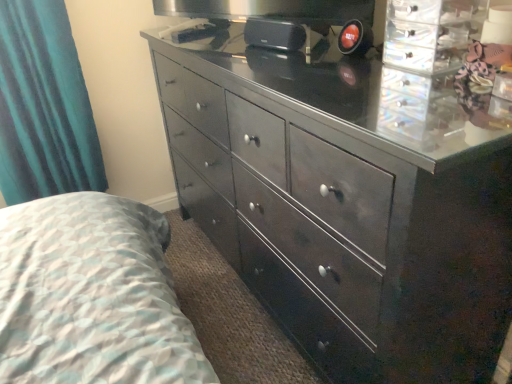
Question: In terms of width, does glossy dark wood dresser at center look wider or thinner when compared to teal velvet curtain at left?

Choices:
 (A) thin
 (B) wide

Answer: (B)

Question: Is glossy dark wood dresser at center in front of or behind teal velvet curtain at left in the image?

Choices:
 (A) behind
 (B) front

Answer: (B)

Question: Considering the positions of glossy dark wood dresser at center and teal velvet curtain at left in the image, is glossy dark wood dresser at center bigger or smaller than teal velvet curtain at left?

Choices:
 (A) big
 (B) small

Answer: (A)

Question: In terms of size, does teal velvet curtain at left appear bigger or smaller than glossy dark wood dresser at center?

Choices:
 (A) small
 (B) big

Answer: (A)

Question: In terms of width, does teal velvet curtain at left look wider or thinner when compared to glossy dark wood dresser at center?

Choices:
 (A) wide
 (B) thin

Answer: (B)

Question: In the image, is teal velvet curtain at left positioned in front of or behind glossy dark wood dresser at center?

Choices:
 (A) behind
 (B) front

Answer: (A)

Question: In the image, is teal velvet curtain at left on the left side or the right side of glossy dark wood dresser at center?

Choices:
 (A) right
 (B) left

Answer: (B)